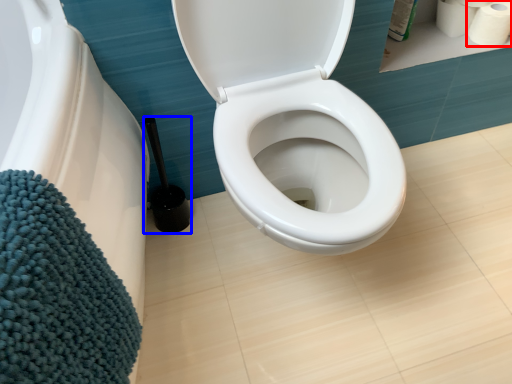
Question: Which object is closer to the camera taking this photo, toilet paper (highlighted by a red box) or brush (highlighted by a blue box)?

Choices:
 (A) toilet paper
 (B) brush

Answer: (B)